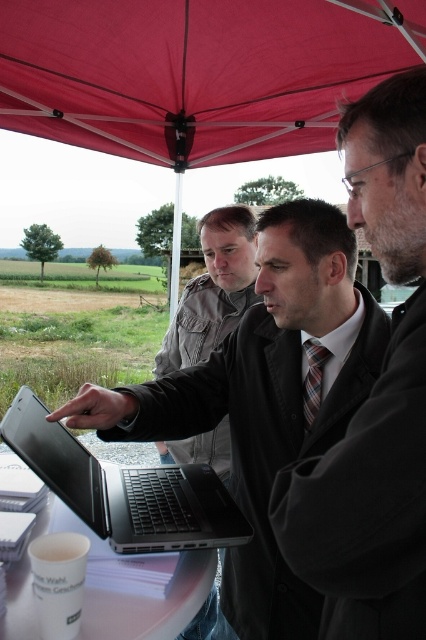
You are standing at the entrance of the tent and want to find the red fabric umbrella at upper center. Based on your current position, which direction should you look to locate it?

The red fabric umbrella at upper center is located at point (196, 74), so you should look towards the upper center direction to find it.

You are standing at the point with coordinates point [132,477] and want to move to the point with coordinates point [167,566]. Which direction should you move to reach there?

You should move forward because point [132,477] is behind point [167,566], so moving forward from point [132,477] will take you towards point [167,566].